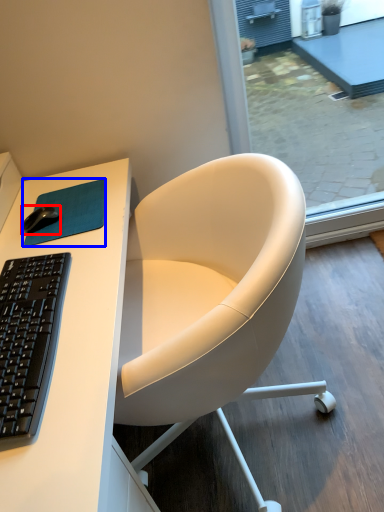
Question: Which of the following is the farthest to the observer, mouse (highlighted by a red box) or mousepad (highlighted by a blue box)?

Choices:
 (A) mouse
 (B) mousepad

Answer: (A)